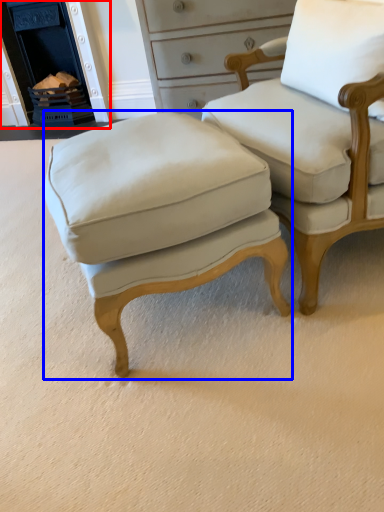
Question: Which object is further to the camera taking this photo, fireplace (highlighted by a red box) or stool (highlighted by a blue box)?

Choices:
 (A) fireplace
 (B) stool

Answer: (A)